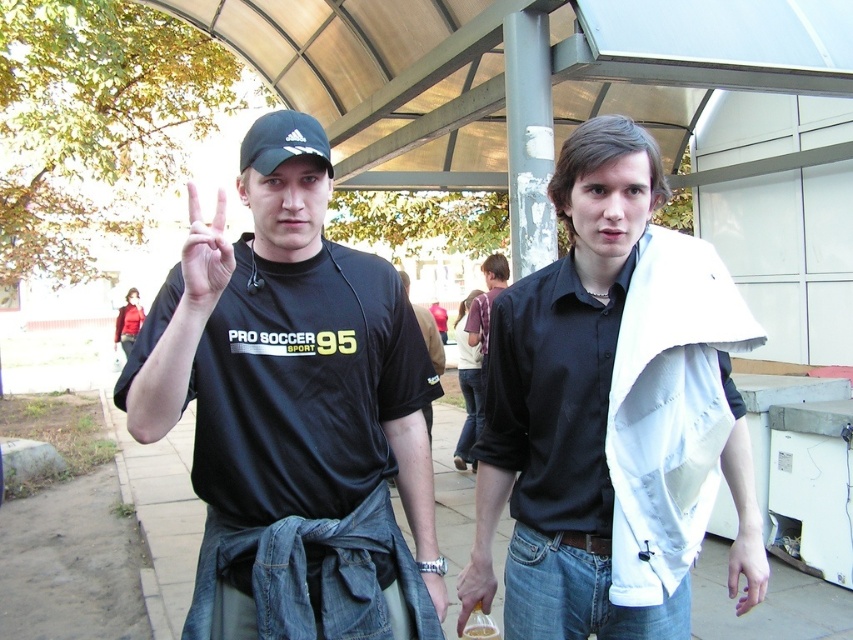
Question: Which object appears farthest from the camera in this image?

Choices:
 (A) white cotton shirt at center
 (B) matte black hand at center
 (C) matte plastic bottle at lower center
 (D) pale skin hand at lower right

Answer: (C)

Question: Can you confirm if black adidas cap at center is bigger than matte plastic bottle at lower center?

Choices:
 (A) no
 (B) yes

Answer: (B)

Question: Which of the following is the closest to the observer?

Choices:
 (A) matte plastic bottle at lower center
 (B) pale skin hand at lower right
 (C) matte black hand at center

Answer: (C)

Question: Can you confirm if white cotton shirt at center is thinner than black adidas cap at center?

Choices:
 (A) yes
 (B) no

Answer: (B)

Question: Is white cotton shirt at center below matte black hand at center?

Choices:
 (A) no
 (B) yes

Answer: (B)

Question: Which is farther from the matte black hand at center?

Choices:
 (A) white cotton shirt at center
 (B) black matte t-shirt at center

Answer: (A)